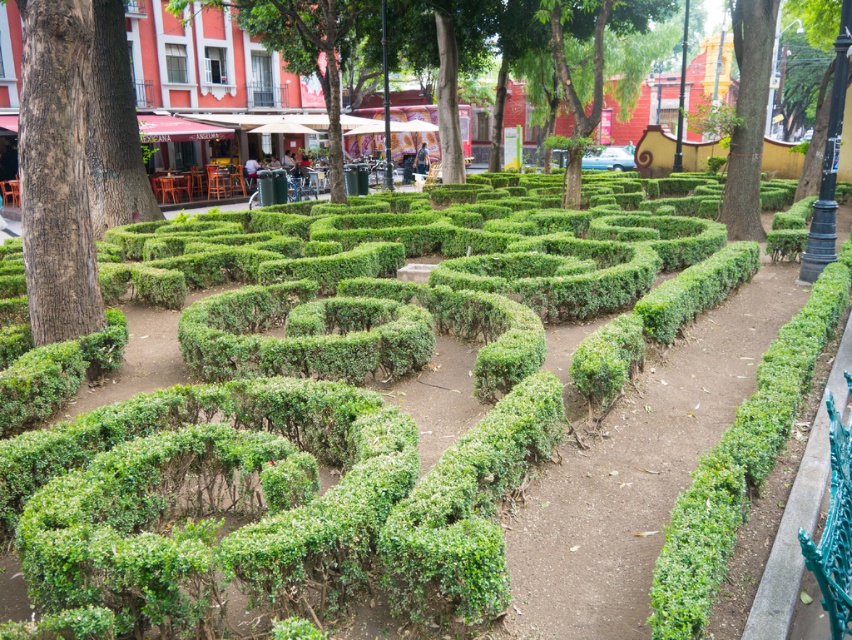
You are standing at the entrance of the hedge maze and notice two trees outside the maze. The brown textured tree trunk at left and the green leafy tree at upper right. Which tree is taller?

The green leafy tree at upper right is taller than the brown textured tree trunk at left.

From the picture: You are standing in the hedge maze and want to find the nearest tree trunk to lean against. Which tree should you head towards, the brown textured tree trunk at left or the green leafy tree at upper center?

The brown textured tree trunk at left is located below the green leafy tree at upper center, meaning it is closer to the ground level. Since you are in the hedge maze, you should head towards the brown textured tree trunk at left as it is closer to your current position.